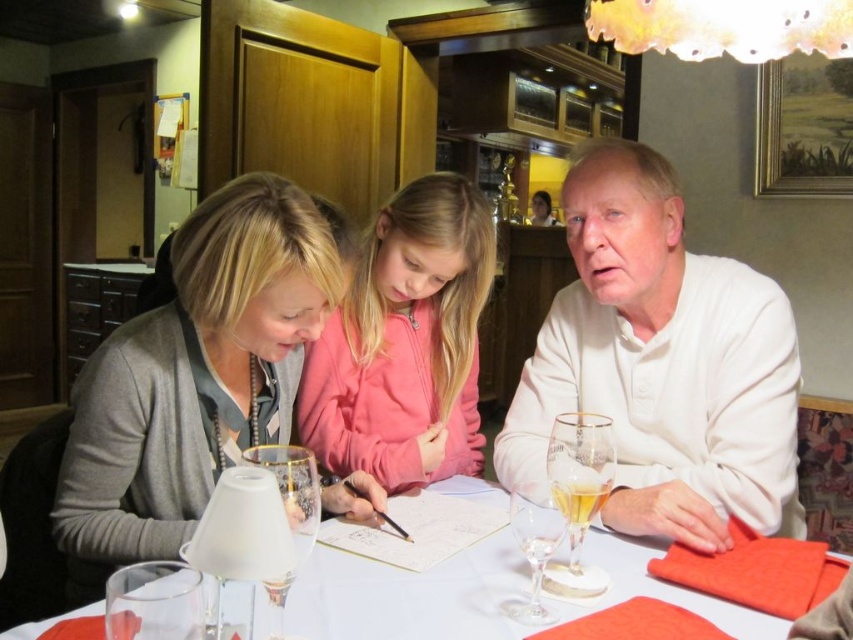
Question: Considering the real-world distances, which object is farthest from the pink fleece jacket at center?

Choices:
 (A) translucent glass beer at right
 (B) clear glass wine glass at table center

Answer: (B)

Question: Is matte gray sweater at left to the left of transparent glass wine glass at lower center from the viewer's perspective?

Choices:
 (A) no
 (B) yes

Answer: (B)

Question: Is pink fleece jacket at center to the right of white paper at center from the viewer's perspective?

Choices:
 (A) yes
 (B) no

Answer: (A)

Question: Which object is the farthest from the transparent glass wine glass at lower center?

Choices:
 (A) pink fleece jacket at center
 (B) matte gray sweater at left

Answer: (A)

Question: Does white matte shirt at right have a smaller size compared to matte gray sweater at left?

Choices:
 (A) yes
 (B) no

Answer: (B)

Question: Based on their relative distances, which object is nearer to the pink fleece jacket at center?

Choices:
 (A) white matte shirt at right
 (B) white paper at center

Answer: (A)